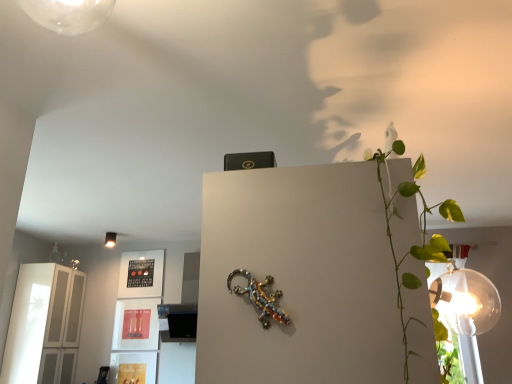
This screenshot has width=512, height=384. Identify the location of matte white lampshade at upper left. (110, 239).

The height and width of the screenshot is (384, 512). I want to click on metallic beaded lizard at center, so click(x=260, y=297).

Is metallic beaded lizard at center taller or shorter than white glossy cabinet at left?

metallic beaded lizard at center is shorter than white glossy cabinet at left.

Does metallic beaded lizard at center have a smaller size compared to white glossy cabinet at left?

Correct, metallic beaded lizard at center occupies less space than white glossy cabinet at left.

In the image, there is a white glossy cabinet at left. At what (x,y) coordinates should I click in order to perform the action: click on lizard above it (from the image's perspective). Please return your answer as a coordinate pair (x, y). The width and height of the screenshot is (512, 384). Looking at the image, I should click on (260, 297).

Is white glossy cabinet at left wider or thinner than metallic beaded lizard at center?

white glossy cabinet at left is wider than metallic beaded lizard at center.

Looking at this image, is white glossy cabinet at left facing away from metallic beaded lizard at center?

No, metallic beaded lizard at center is not at the back of white glossy cabinet at left.

Based on their sizes in the image, would you say matte white lampshade at upper left is bigger or smaller than metallic beaded lizard at center?

matte white lampshade at upper left is bigger than metallic beaded lizard at center.

Based on their positions, is matte white lampshade at upper left located to the left or right of metallic beaded lizard at center?

Clearly, matte white lampshade at upper left is on the left of metallic beaded lizard at center in the image.

How distant is matte white lampshade at upper left from metallic beaded lizard at center?

A distance of 3.71 meters exists between matte white lampshade at upper left and metallic beaded lizard at center.

Is matte white lampshade at upper left wider or thinner than metallic beaded lizard at center?

Clearly, matte white lampshade at upper left has more width compared to metallic beaded lizard at center.

Is white glossy cabinet at left thinner than matte white lampshade at upper left?

No.

From a real-world perspective, is white glossy cabinet at left under matte white lampshade at upper left?

Yes.

From the image's perspective, is white glossy cabinet at left positioned above or below matte white lampshade at upper left?

From the image's perspective, white glossy cabinet at left appears below matte white lampshade at upper left.

From the image's perspective, does metallic beaded lizard at center appear lower than matte white lampshade at upper left?

Incorrect, from the image's perspective, metallic beaded lizard at center is higher than matte white lampshade at upper left.

In the scene shown: Considering their positions, is metallic beaded lizard at center located in front of or behind matte white lampshade at upper left?

Visually, metallic beaded lizard at center is located in front of matte white lampshade at upper left.

From a real-world perspective, which is physically below, metallic beaded lizard at center or matte white lampshade at upper left?

metallic beaded lizard at center, from a real-world perspective.

Based on the photo, which of these two, metallic beaded lizard at center or matte white lampshade at upper left, is wider?

Wider between the two is matte white lampshade at upper left.

Can you tell me how much matte white lampshade at upper left and white glossy cabinet at left differ in facing direction?

The angle between the facing direction of matte white lampshade at upper left and the facing direction of white glossy cabinet at left is 88.3 degrees.

From a real-world perspective, is matte white lampshade at upper left beneath white glossy cabinet at left?

No, from a real-world perspective, matte white lampshade at upper left is not under white glossy cabinet at left.

Considering the sizes of objects matte white lampshade at upper left and white glossy cabinet at left in the image provided, who is taller, matte white lampshade at upper left or white glossy cabinet at left?

With more height is white glossy cabinet at left.

Considering their positions, is matte white lampshade at upper left located in front of or behind white glossy cabinet at left?

matte white lampshade at upper left is positioned farther from the viewer than white glossy cabinet at left.

Locate an element on the screen. This screenshot has height=384, width=512. lizard beneath the white glossy cabinet at left (from a real-world perspective) is located at coordinates (260, 297).

The height and width of the screenshot is (384, 512). Find the location of `glass door located above the metallic beaded lizard at center (from a real-world perspective)`. glass door located above the metallic beaded lizard at center (from a real-world perspective) is located at coordinates (44, 325).

When comparing their distances from metallic beaded lizard at center, does matte white lampshade at upper left or white glossy cabinet at left seem closer?

white glossy cabinet at left lies closer to metallic beaded lizard at center than the other object.

When comparing their distances from matte white lampshade at upper left, does metallic beaded lizard at center or white glossy cabinet at left seem closer?

The object closer to matte white lampshade at upper left is white glossy cabinet at left.

From the image, which object appears to be farther from white glossy cabinet at left, matte white lampshade at upper left or metallic beaded lizard at center?

metallic beaded lizard at center.

Looking at the image, which one is located further to metallic beaded lizard at center, white glossy cabinet at left or matte white lampshade at upper left?

matte white lampshade at upper left is further to metallic beaded lizard at center.

Based on their spatial positions, is metallic beaded lizard at center or matte white lampshade at upper left further from white glossy cabinet at left?

metallic beaded lizard at center is positioned further to the anchor white glossy cabinet at left.

Based on their spatial positions, is white glossy cabinet at left or metallic beaded lizard at center closer to matte white lampshade at upper left?

The object closer to matte white lampshade at upper left is white glossy cabinet at left.

Find the location of `glass door positioned between metallic beaded lizard at center and matte white lampshade at upper left from near to far`. glass door positioned between metallic beaded lizard at center and matte white lampshade at upper left from near to far is located at coordinates (44, 325).